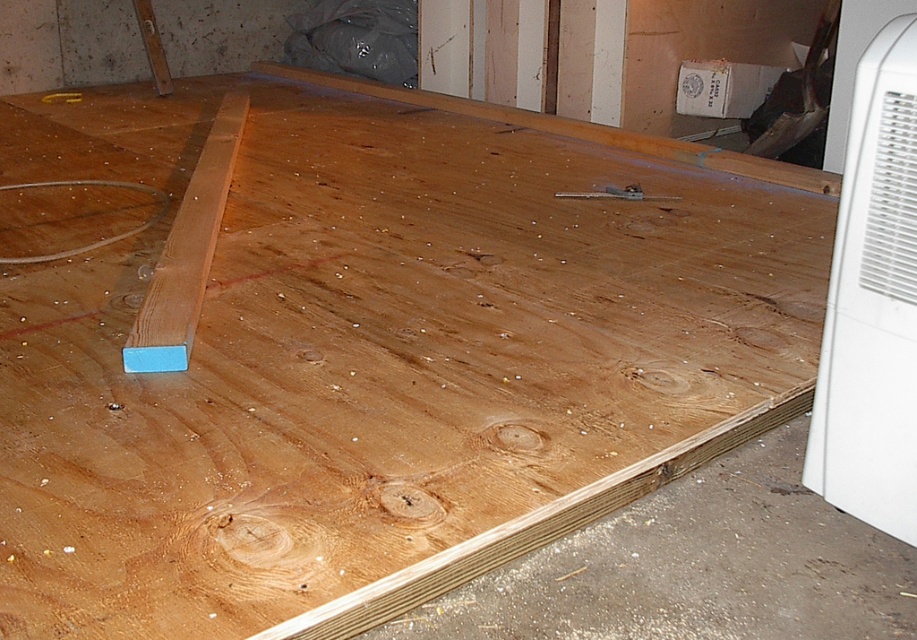
You are a contractor looking to install a new air conditioner unit. You have the white plastic air conditioner at right and need to place it next to the light brown wood plank at lower left. Considering their heights, will the air conditioner fit under a standard 8ft ceiling without any adjustments?

The white plastic air conditioner at right is shorter than the light brown wood plank at lower left. Since the plank is taller than the air conditioner, but the exact height of the air conditioner isn not specified, we cannot definitively determine if it will fit under an 8ft ceiling. Additional measurements are needed.

You are standing at the point with coordinates point (882, 376) and want to move towards the point with coordinates point (203, 221) in the basement. Which direction should you move to reach the second point?

Since point (882, 376) is in front of point (203, 221), you should move backward to reach the second point.

Looking at this image, you are an installer setting up an air conditioner. You see the white plastic air conditioner at right and the blue plastic square at lower left. Which object is bigger?

The white plastic air conditioner at right is larger in size than the blue plastic square at lower left.